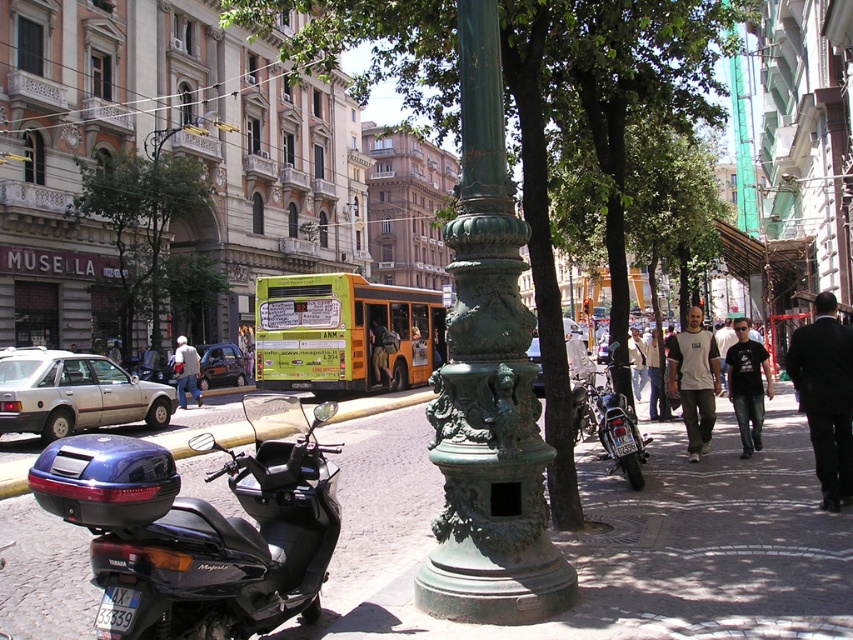
You are standing in the middle of the street and want to take a photo of the two points mentioned. Which point, point [523,83] or point [77,211], will appear larger in your camera view?

Point [523,83] is closer to the camera than point [77,211], so it will appear larger in the camera view.

You are a delivery person who needs to park your scooter closer to the sidewalk. Based on the scene, can you determine if the black glossy scooter at lower left is already positioned in front of the green patinated metal streetlamp at upper left?

Yes, the black glossy scooter at lower left is already positioned in front of the green patinated metal streetlamp at upper left, as stated in the description.

You are a delivery person standing at the point marked by coordinates point (x=201, y=528). You need to deliver a package to the green ornate lamppost in the foreground. Is the scooter blocking your path to the lamppost?

The point (x=201, y=528) is on black glossy scooter at lower left. The scooter is parked on the sidewalk to the left of the lamppost, so the scooter is blocking your path to the green ornate lamppost in the foreground.